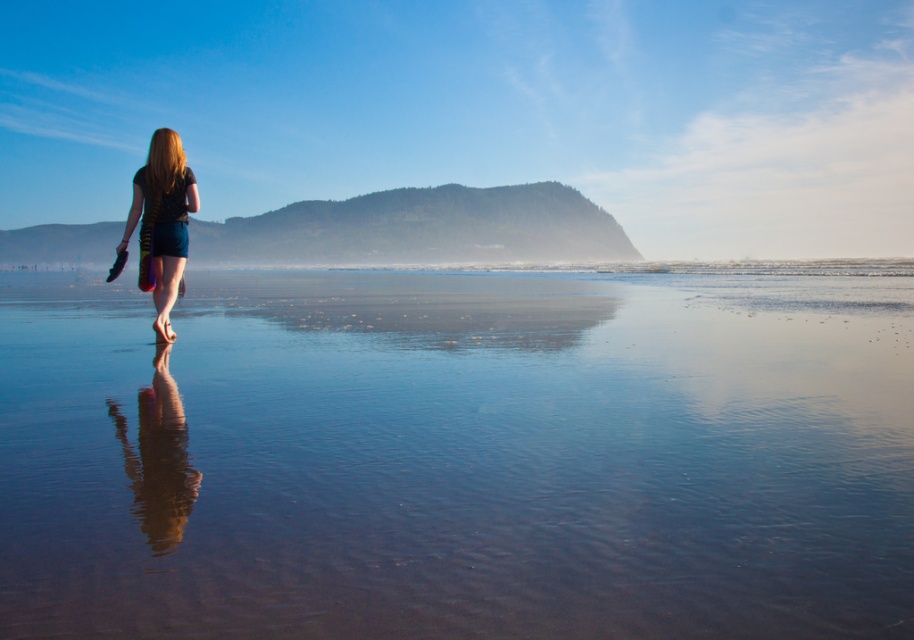
You are standing at the point marked as point (458, 456) in the image. Based on the scene description, what type of surface are you currently standing on?

The point (458, 456) is on clear water at center, so you are standing on clear water.

In the scene shown: You are a photographer trying to capture the reflection of the matte black shorts at center in the clear water at center. Based on the scene, will the reflection be fully visible in the water?

The clear water at center has a lesser height compared to matte black shorts at center, so the reflection of the matte black shorts at center will be fully visible in the clear water at center because the water is deep enough to reflect it.